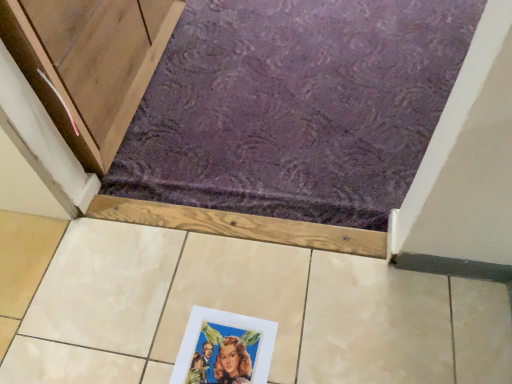
Question: Is matte paper picture frame at lower center situated inside purple textured carpet at upper center or outside?

Choices:
 (A) inside
 (B) outside

Answer: (B)

Question: Visually, is matte paper picture frame at lower center positioned to the left or to the right of purple textured carpet at upper center?

Choices:
 (A) right
 (B) left

Answer: (B)

Question: Is matte paper picture frame at lower center in front of or behind purple textured carpet at upper center in the image?

Choices:
 (A) behind
 (B) front

Answer: (B)

Question: Is point (336, 157) closer or farther from the camera than point (190, 377)?

Choices:
 (A) farther
 (B) closer

Answer: (A)

Question: Considering their positions, is purple textured carpet at upper center located in front of or behind matte paper picture frame at lower center?

Choices:
 (A) front
 (B) behind

Answer: (B)

Question: Considering the positions of purple textured carpet at upper center and matte paper picture frame at lower center in the image, is purple textured carpet at upper center wider or thinner than matte paper picture frame at lower center?

Choices:
 (A) wide
 (B) thin

Answer: (A)

Question: In the image, is purple textured carpet at upper center on the left side or the right side of matte paper picture frame at lower center?

Choices:
 (A) right
 (B) left

Answer: (A)